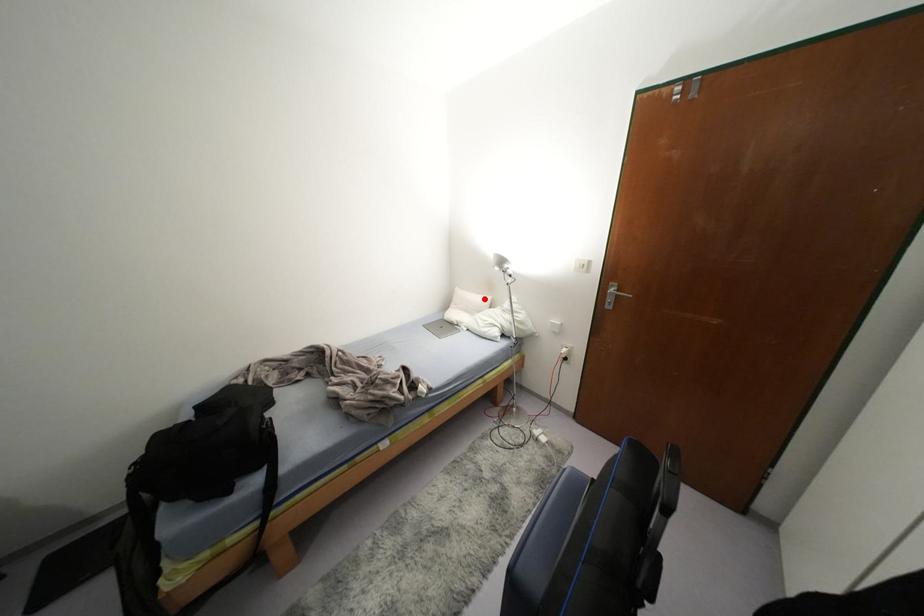
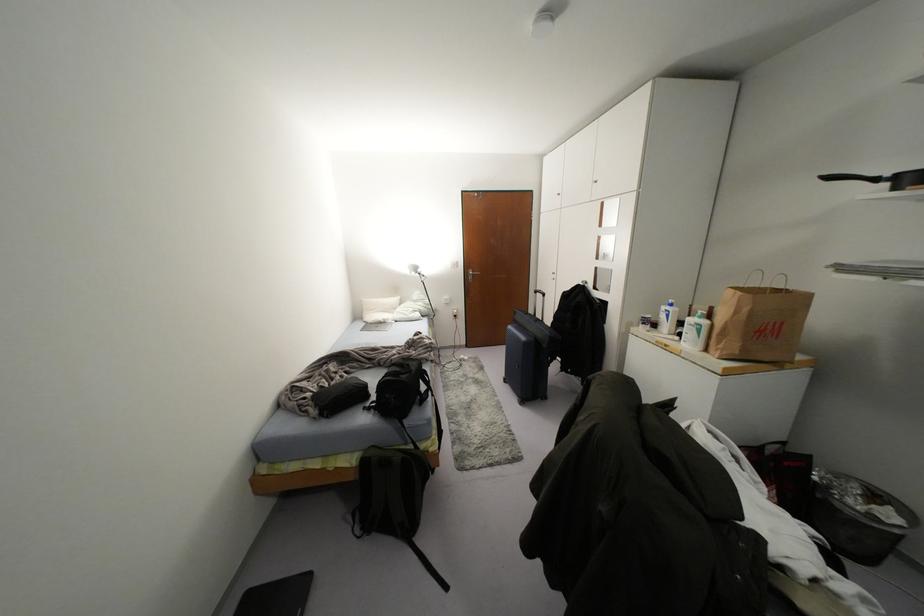
Find the pixel in the second image that matches the highlighted location in the first image.

(394, 299)